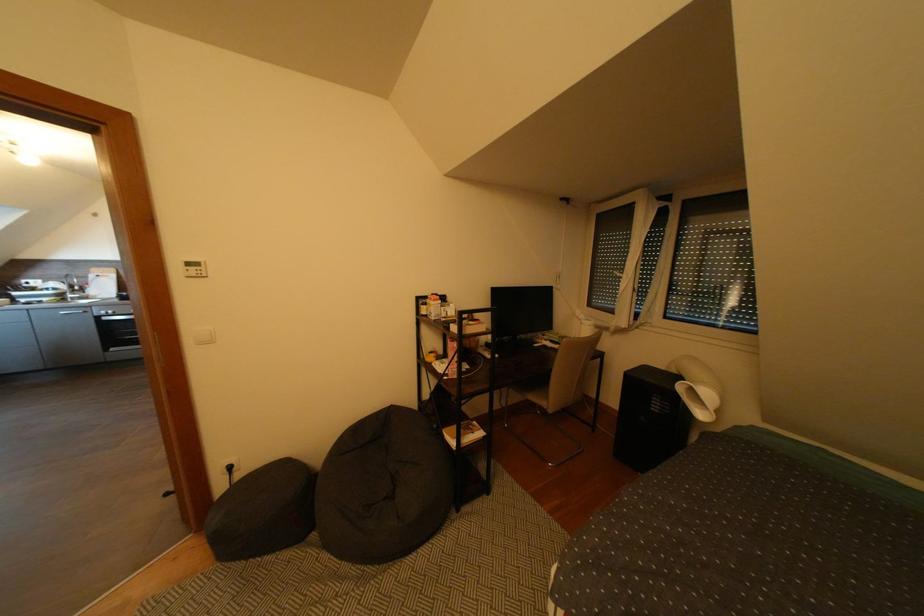
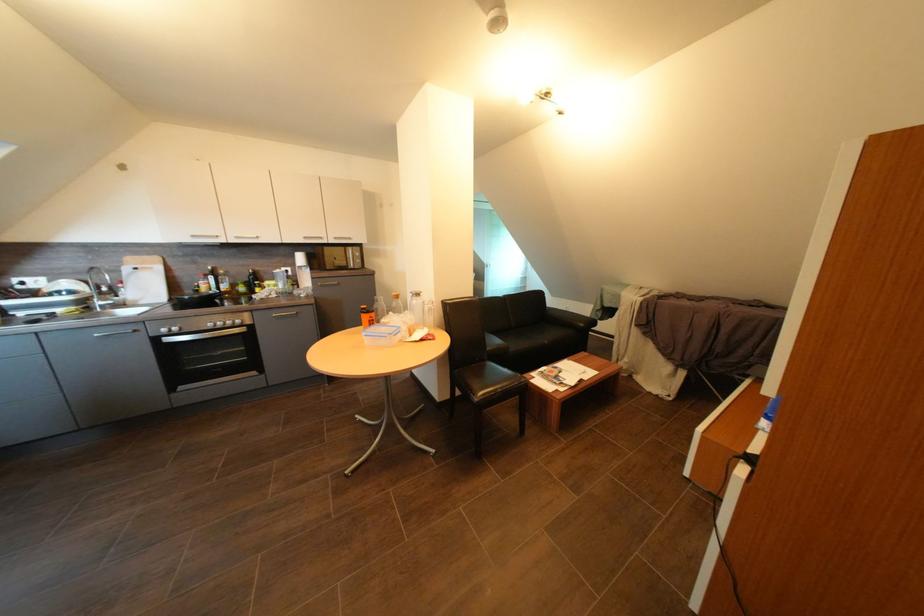
Which direction would the cameraman need to move to produce the second image?

The cameraman moved toward left, forward.